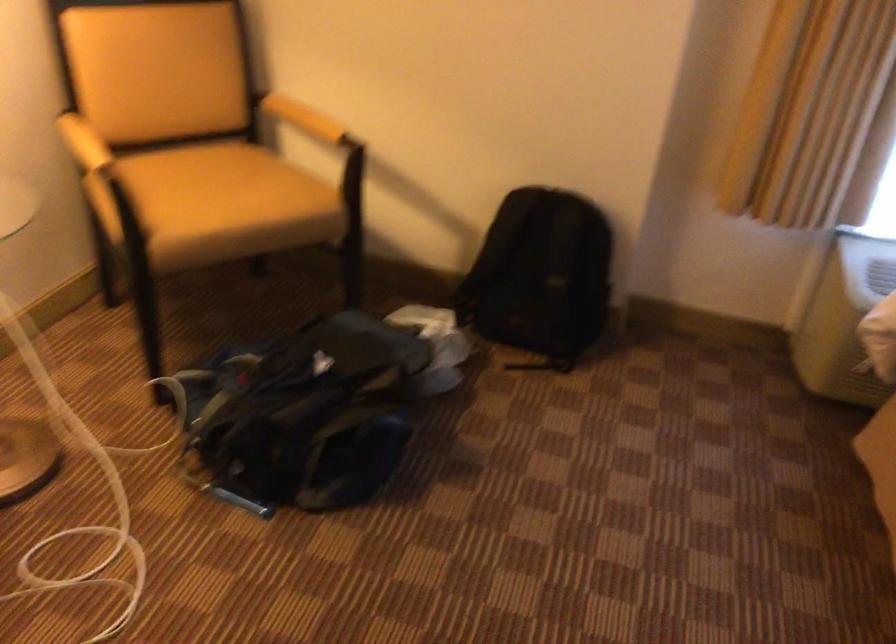
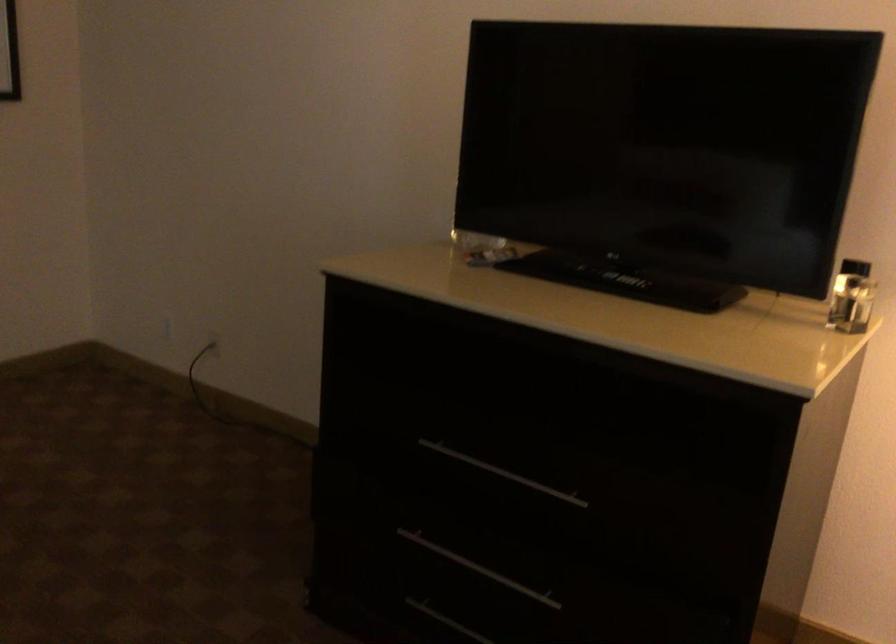
The first image is from the beginning of the video and the second image is from the end. How did the camera likely rotate when shooting the video?

The camera rotated toward left-down.